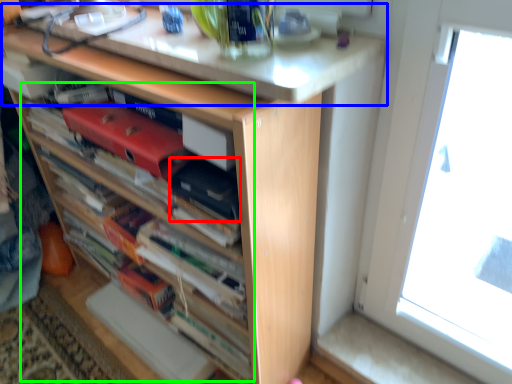
Question: Estimate the real-world distances between objects in this image. Which object is farther from paperback book (highlighted by a red box), counter top (highlighted by a blue box) or book (highlighted by a green box)?

Choices:
 (A) counter top
 (B) book

Answer: (B)